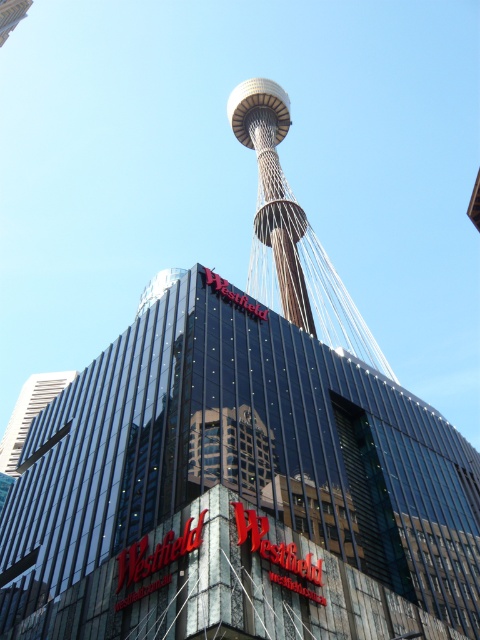
Question: Which object is closer to the camera taking this photo?

Choices:
 (A) glassy steel tower at center
 (B) gold metallic tower at center

Answer: (A)

Question: Does glassy steel tower at center come behind gold metallic tower at center?

Choices:
 (A) yes
 (B) no

Answer: (B)

Question: Among these objects, which one is farthest from the camera?

Choices:
 (A) gold metallic tower at center
 (B) glassy steel tower at center

Answer: (A)

Question: Does glassy steel tower at center have a larger size compared to gold metallic tower at center?

Choices:
 (A) yes
 (B) no

Answer: (A)

Question: Does glassy steel tower at center come behind gold metallic tower at center?

Choices:
 (A) no
 (B) yes

Answer: (A)